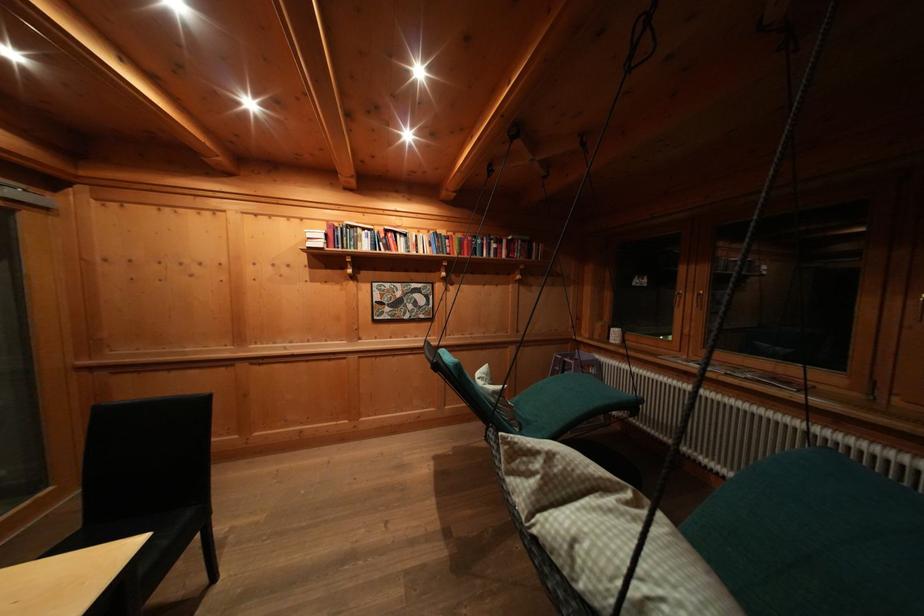
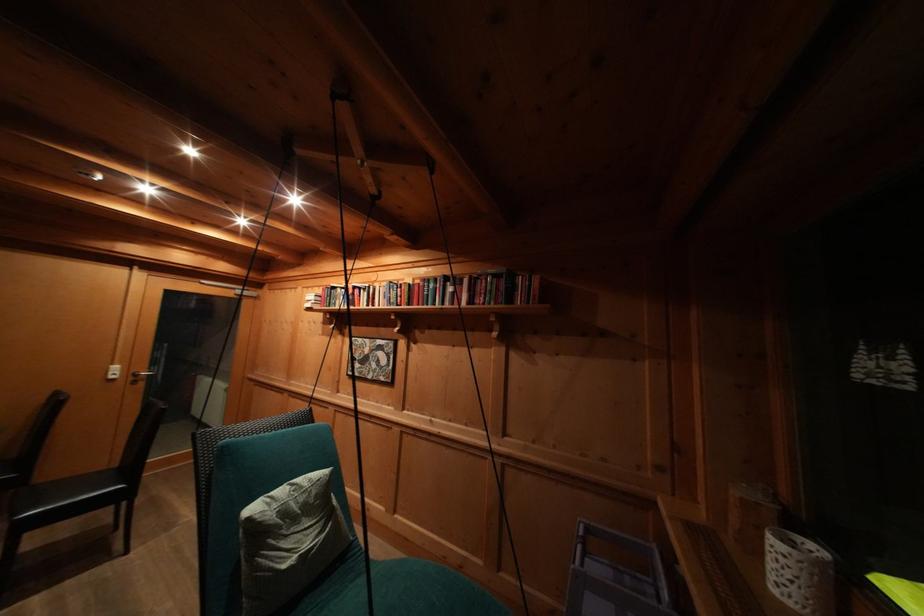
In the second image, find the point that corresponds to (x=485, y=246) in the first image.

(438, 291)